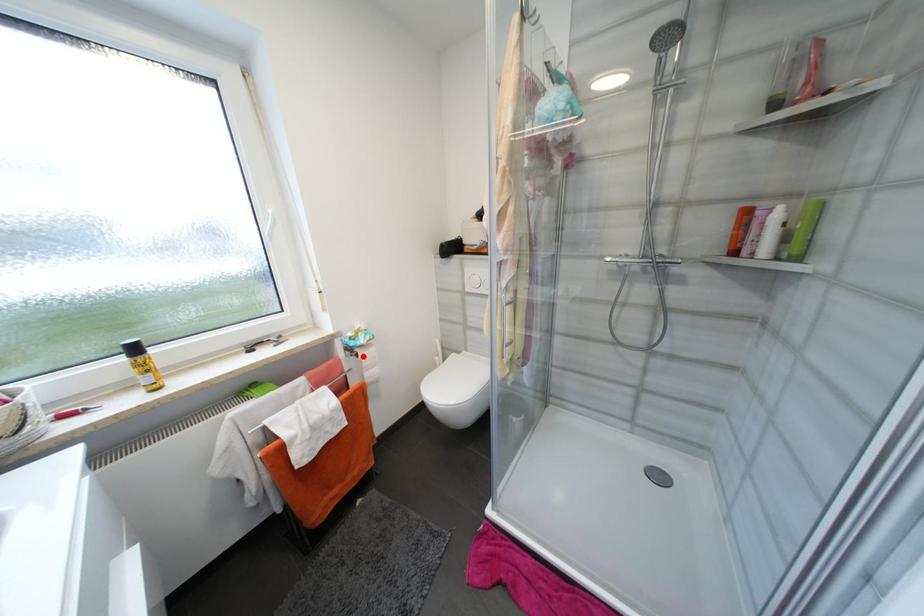
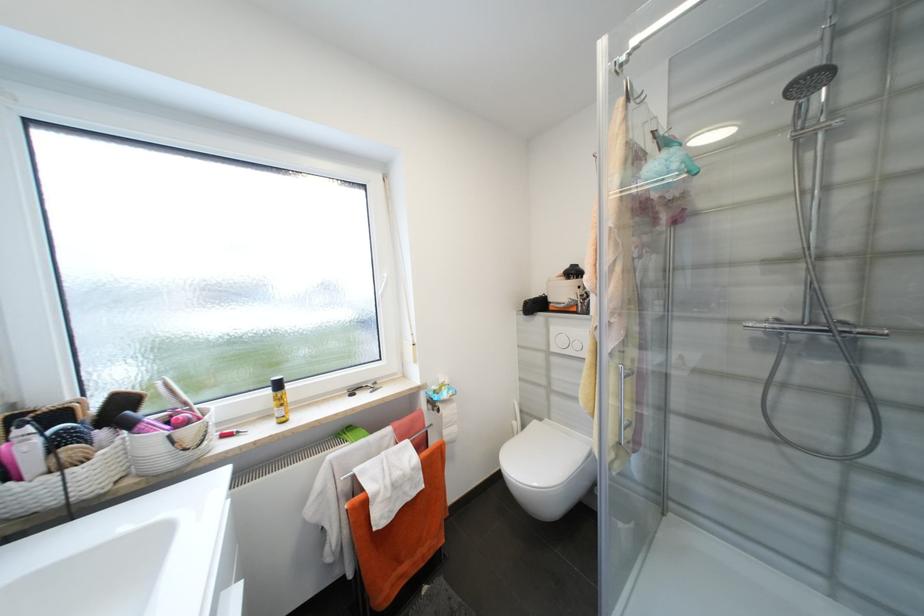
Question: I am providing you with two images of the same scene from different viewpoints. A red point is marked on the first image. Can you still see the location of the red point in image 2?

Choices:
 (A) Yes
 (B) No

Answer: (A)